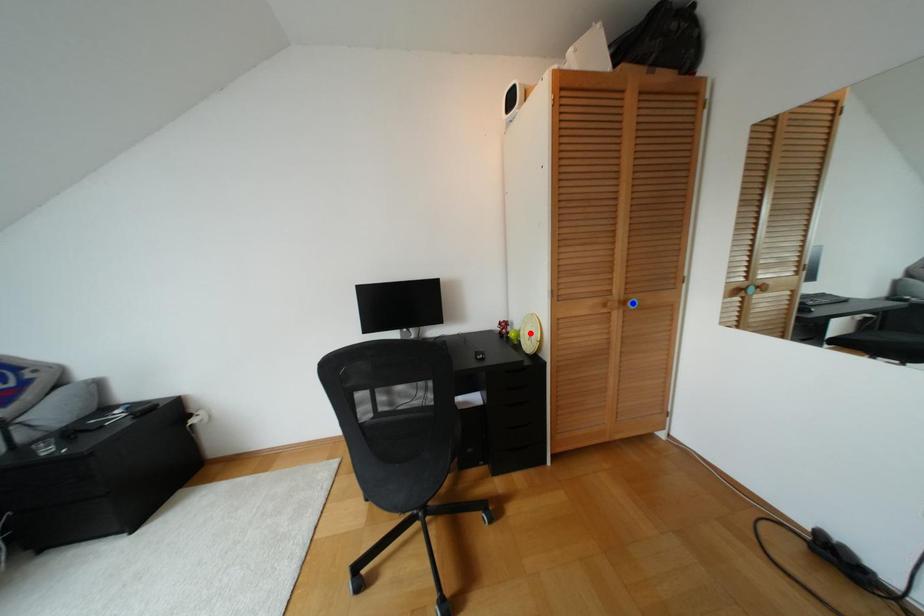
Question: In the image, two points are highlighted. Which point is nearer to the camera? Reply with the corresponding letter.

Choices:
 (A) blue point
 (B) red point

Answer: (A)